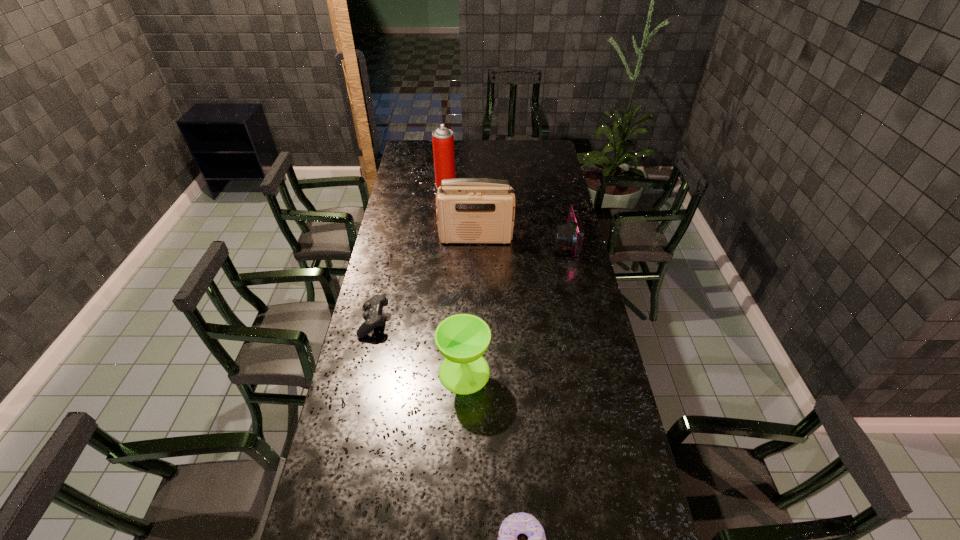
Where is `vacant space at the far left corner`? vacant space at the far left corner is located at coordinates (405, 143).

Locate an element on the screen. This screenshot has width=960, height=540. free space at the far right corner of the desktop is located at coordinates (555, 159).

Identify the location of empty space between the wineglass and the farthest object. The height and width of the screenshot is (540, 960). (455, 279).

Where is `vacant area that lies between the radio receiver and the fifth tallest object`? The height and width of the screenshot is (540, 960). vacant area that lies between the radio receiver and the fifth tallest object is located at coordinates (425, 280).

What are the coordinates of `free space between the rightmost object and the leftmost object` in the screenshot? It's located at (469, 282).

Where is `free space between the radio receiver and the leftmost object`? The width and height of the screenshot is (960, 540). free space between the radio receiver and the leftmost object is located at coordinates (425, 280).

Locate which object is the fifth closest to the second nearest object. Please provide its 2D coordinates. Your answer should be formatted as a tuple, i.e. [(x, y)], where the tuple contains the x and y coordinates of a point satisfying the conditions above.

[(442, 138)]

The width and height of the screenshot is (960, 540). I want to click on object that is the third nearest to the radio receiver, so pyautogui.click(x=373, y=318).

Locate an element on the screen. This screenshot has height=540, width=960. vacant position in the image that satisfies the following two spatial constraints: 1. on the front side of the aerosol can; 2. on the right side of the third tallest object is located at coordinates (427, 372).